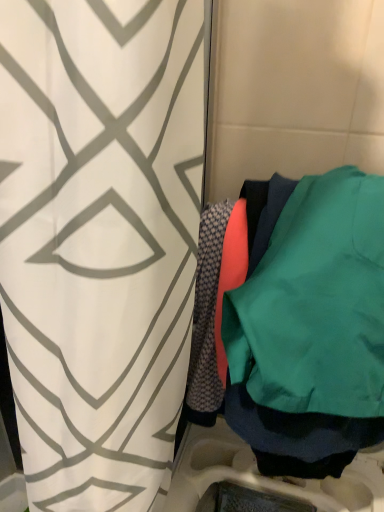
Question: Considering the positions of teal matte sweatshirt at right and white geometric-patterned curtain at center in the image, is teal matte sweatshirt at right taller or shorter than white geometric-patterned curtain at center?

Choices:
 (A) tall
 (B) short

Answer: (B)

Question: Is teal matte sweatshirt at right spatially inside white geometric-patterned curtain at center, or outside of it?

Choices:
 (A) inside
 (B) outside

Answer: (B)

Question: From a real-world perspective, relative to white geometric-patterned curtain at center, is teal matte sweatshirt at right vertically above or below?

Choices:
 (A) below
 (B) above

Answer: (B)

Question: From a real-world perspective, relative to teal matte sweatshirt at right, is white geometric-patterned curtain at center vertically above or below?

Choices:
 (A) above
 (B) below

Answer: (B)

Question: Is point (61, 346) positioned closer to the camera than point (306, 352)?

Choices:
 (A) closer
 (B) farther

Answer: (A)

Question: Based on their sizes in the image, would you say white geometric-patterned curtain at center is bigger or smaller than teal matte sweatshirt at right?

Choices:
 (A) big
 (B) small

Answer: (A)

Question: Considering the positions of white geometric-patterned curtain at center and teal matte sweatshirt at right in the image, is white geometric-patterned curtain at center taller or shorter than teal matte sweatshirt at right?

Choices:
 (A) short
 (B) tall

Answer: (B)